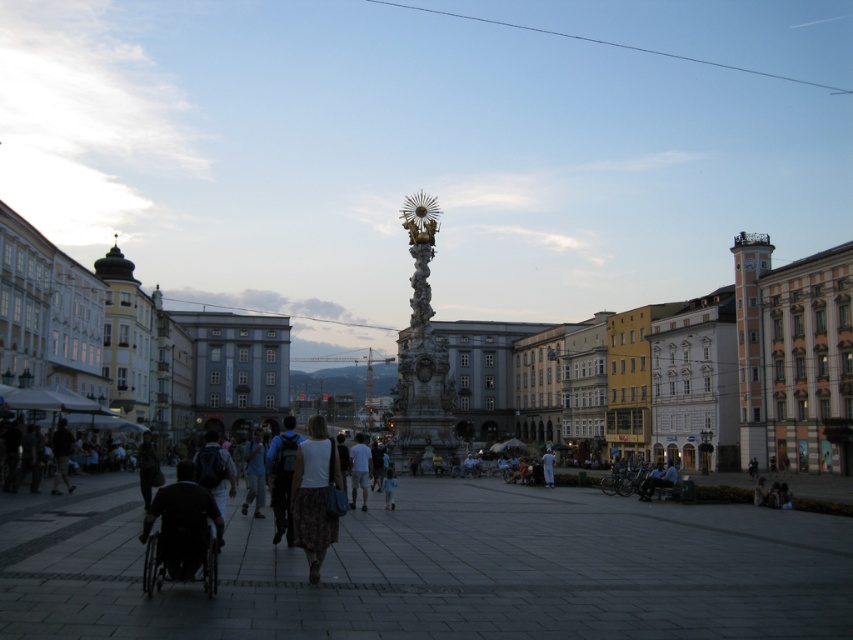
You are a fashion designer observing the urban square scene. You notice the white fabric dress at center and the dark gray fabric jacket at lower left. Which of these two items has a smaller overall size?

The white fabric dress at center has a smaller overall size than the dark gray fabric jacket at lower left because it occupies less space.

You are a fashion designer observing the urban square scene. You notice the light blue denim jeans at center and the dark gray fabric jacket at lower left. Which item of clothing is bigger in size?

The light blue denim jeans at center is larger in size than the dark gray fabric jacket at lower left.

You are a fashion designer observing the urban square scene. You notice the light blue denim jeans at center and the dark gray fabric jacket at lower left. Which of these two items has a greater height in the image?

The light blue denim jeans at center has a greater height compared to the dark gray fabric jacket at lower left.